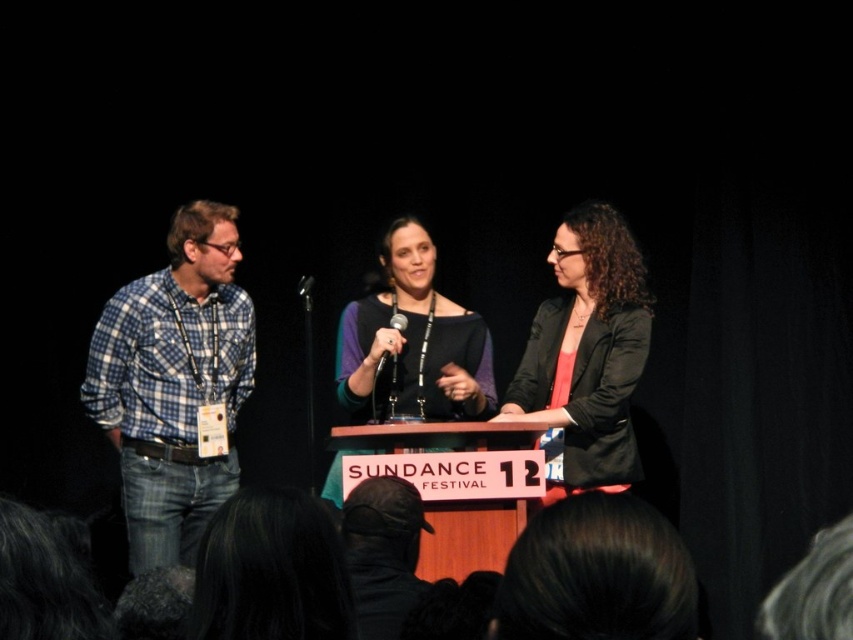
Question: Which point is closer to the camera taking this photo?

Choices:
 (A) (409, 262)
 (B) (206, 358)
 (C) (612, 353)

Answer: (C)

Question: Which object is farther from the camera taking this photo?

Choices:
 (A) blue plaid shirt at left
 (B) black plastic microphone at center
 (C) matte black blazer at center
 (D) metallic silver microphone at center

Answer: (D)

Question: Estimate the real-world distances between objects in this image. Which object is closer to the black plastic microphone at center?

Choices:
 (A) metallic silver microphone at center
 (B) blue plaid shirt at left

Answer: (A)

Question: Does matte black sweater at center have a greater width compared to metallic silver microphone at center?

Choices:
 (A) no
 (B) yes

Answer: (B)

Question: Can you confirm if matte black blazer at center is thinner than black plastic microphone at center?

Choices:
 (A) yes
 (B) no

Answer: (B)

Question: Is blue plaid shirt at left positioned before matte black sweater at center?

Choices:
 (A) no
 (B) yes

Answer: (A)